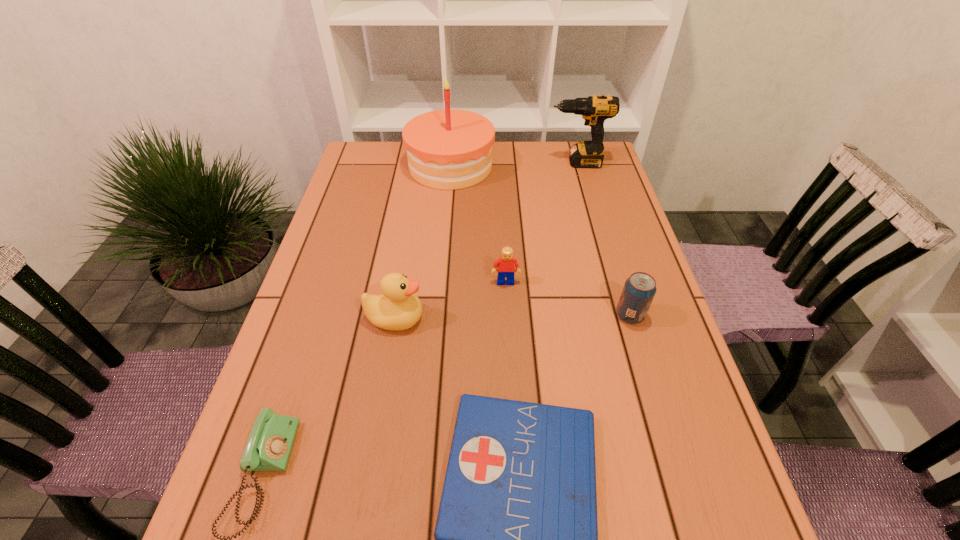
At what (x,y) coordinates should I click in order to perform the action: click on free spot located 0.330m on the back of the pop soda. Please return your answer as a coordinate pair (x, y). This screenshot has height=540, width=960. Looking at the image, I should click on pyautogui.click(x=600, y=216).

Find the location of a particular element. blank area located on the front-facing side of the Lego is located at coordinates (510, 348).

You are a GUI agent. You are given a task and a screenshot of the screen. Output one action in this format:
    pyautogui.click(x=<x>, y=<y>)
    Task: Click on the birthday cake present at the far edge
    This screenshot has width=960, height=540.
    Given the screenshot: What is the action you would take?
    pyautogui.click(x=449, y=149)

Where is `drill that is at the far edge`? This screenshot has height=540, width=960. drill that is at the far edge is located at coordinates (595, 109).

This screenshot has width=960, height=540. Find the location of `drill at the right edge`. drill at the right edge is located at coordinates (595, 109).

Where is `pop soda that is at the right edge`? This screenshot has height=540, width=960. pop soda that is at the right edge is located at coordinates (639, 289).

The image size is (960, 540). What are the coordinates of `object that is at the far right corner` in the screenshot? It's located at (595, 109).

I want to click on vacant space at the far edge of the desktop, so click(504, 167).

Find the location of `free region at the left edge of the desktop`. free region at the left edge of the desktop is located at coordinates (371, 275).

At what (x,y) coordinates should I click in order to perform the action: click on free region at the right edge of the desktop. Please return your answer as a coordinate pair (x, y). This screenshot has height=540, width=960. Looking at the image, I should click on (588, 235).